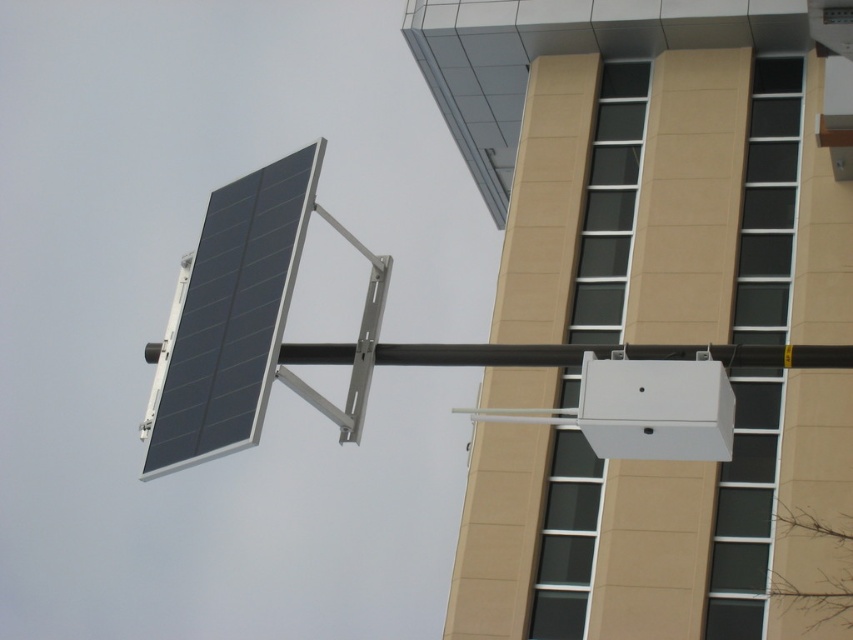
You are a city planner assessing the installation of solar panels. You notice the black matte solar panel at upper left and the black matte pole at center. Which object would require more space for installation considering their sizes?

The black matte solar panel at upper left requires more space for installation because it is larger in size than the black matte pole at center.